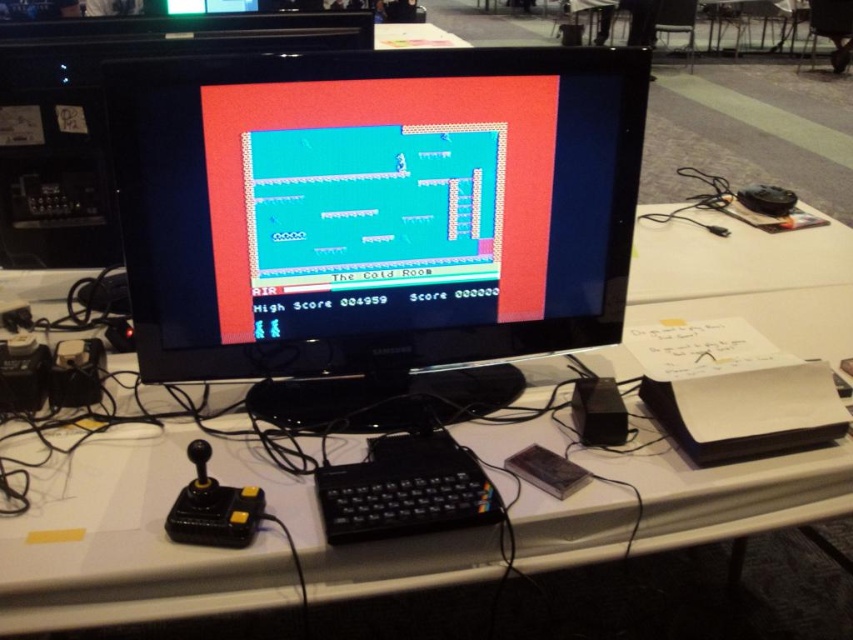
Who is taller, black glossy monitor at center or white plastic computer desk at center?

Standing taller between the two is white plastic computer desk at center.

Can you confirm if black glossy monitor at center is bigger than white plastic computer desk at center?

No, black glossy monitor at center is not bigger than white plastic computer desk at center.

Is point (297, 298) more distant than point (38, 563)?

Yes, point (297, 298) is farther from viewer.

Where is `black glossy monitor at center`? black glossy monitor at center is located at coordinates (374, 220).

Can you confirm if white plastic computer desk at center is positioned above black plastic keyboard at center?

Indeed, white plastic computer desk at center is positioned over black plastic keyboard at center.

Does white plastic computer desk at center have a lesser width compared to black plastic keyboard at center?

In fact, white plastic computer desk at center might be wider than black plastic keyboard at center.

The image size is (853, 640). Identify the location of white plastic computer desk at center. (189, 547).

This screenshot has width=853, height=640. Describe the element at coordinates (374, 220) in the screenshot. I see `black glossy monitor at center` at that location.

Can you confirm if black glossy monitor at center is positioned below black plastic keyboard at center?

No, black glossy monitor at center is not below black plastic keyboard at center.

Image resolution: width=853 pixels, height=640 pixels. Find the location of `black glossy monitor at center`. black glossy monitor at center is located at coordinates (374, 220).

The height and width of the screenshot is (640, 853). I want to click on black glossy monitor at center, so click(x=374, y=220).